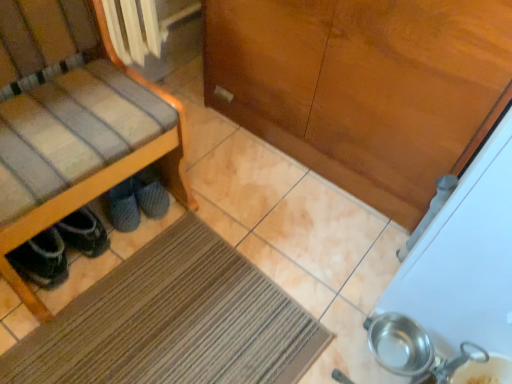
The image size is (512, 384). Identify the location of empty space that is in between wooden chair at left and wooden cabinet at center. (242, 217).